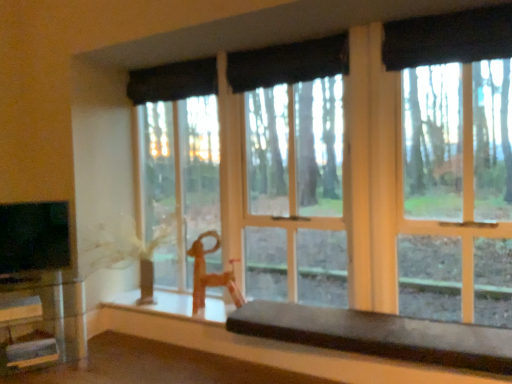
In order to click on free spot below black glossy tv at left (from a real-world perspective) in this screenshot , I will do `click(37, 274)`.